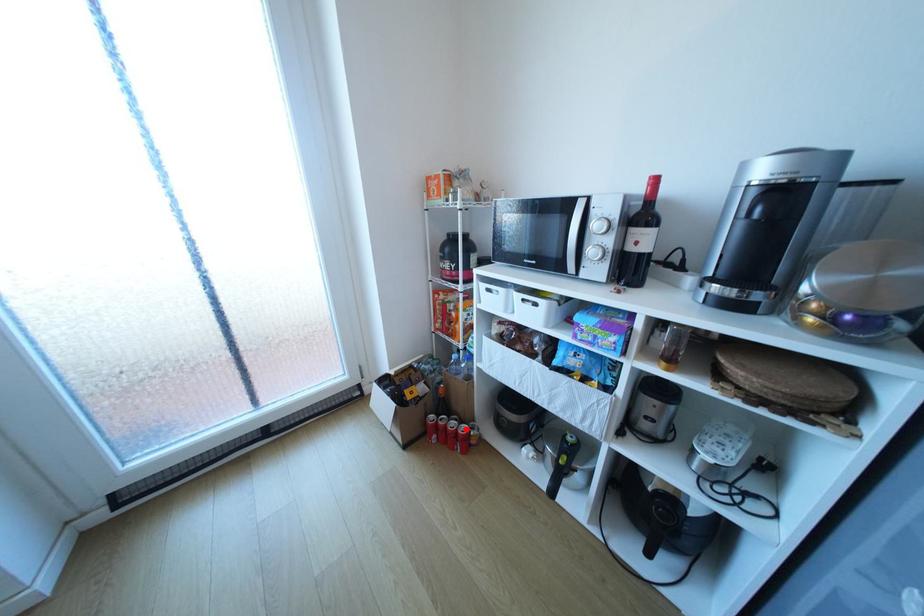
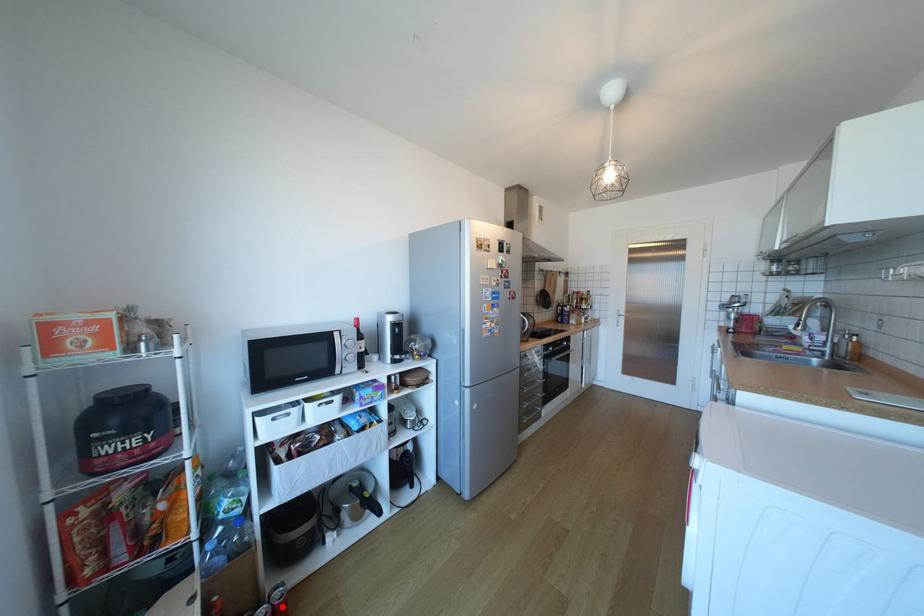
I am providing you with two images of the same scene from different viewpoints. A red point is marked on the first image and another point is marked on the second image. Is the red point in image1 aligned with the point shown in image2?

Yes